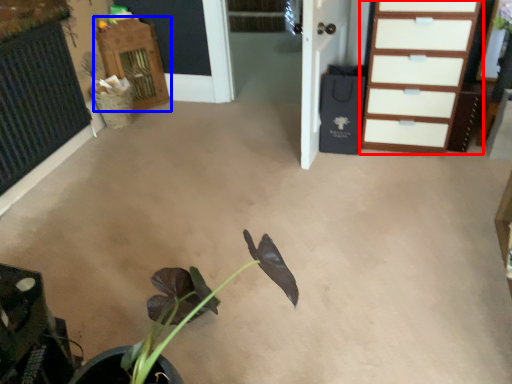
Question: Which point is further to the camera, chest of drawers (highlighted by a red box) or dresser (highlighted by a blue box)?

Choices:
 (A) chest of drawers
 (B) dresser

Answer: (B)